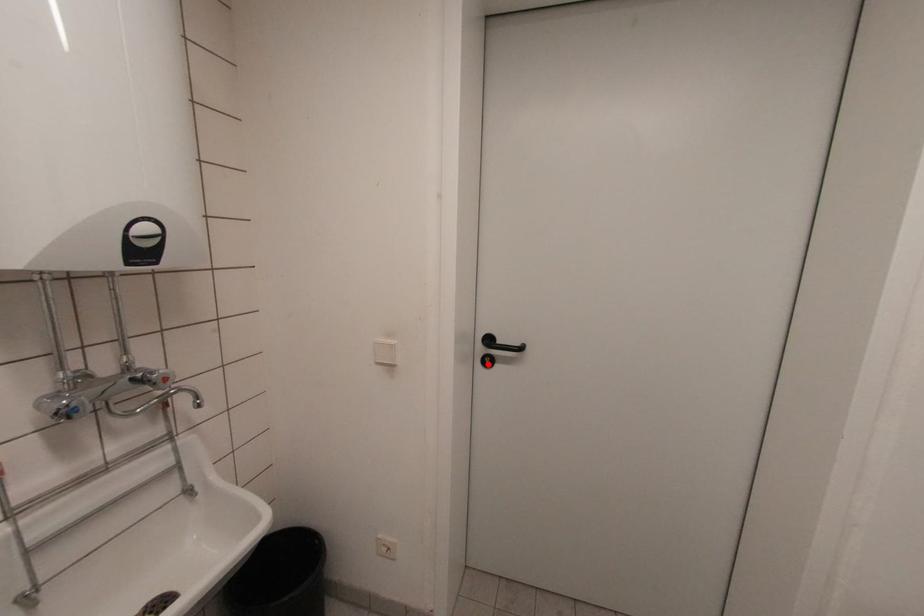
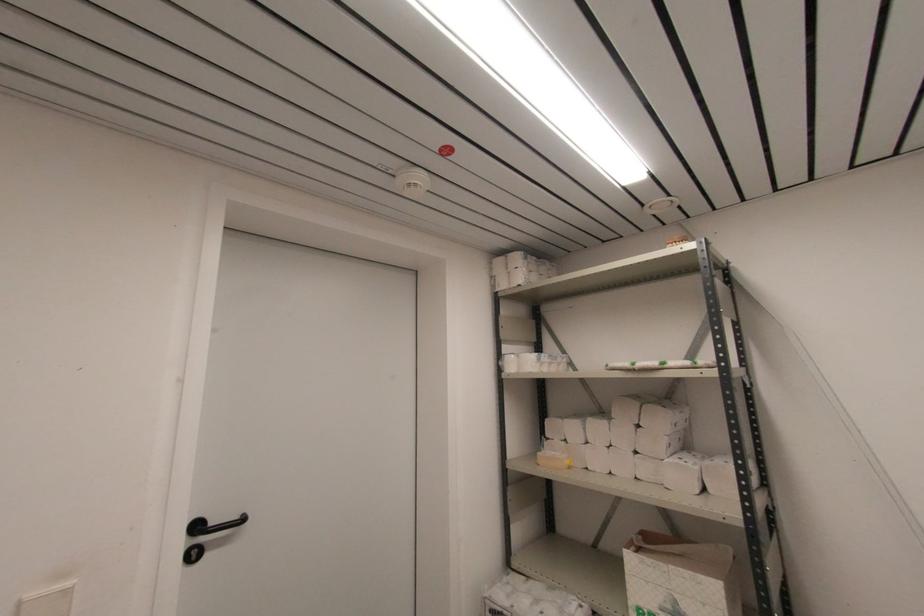
Find the pixel in the second image that matches the highlighted location in the first image.

(196, 557)